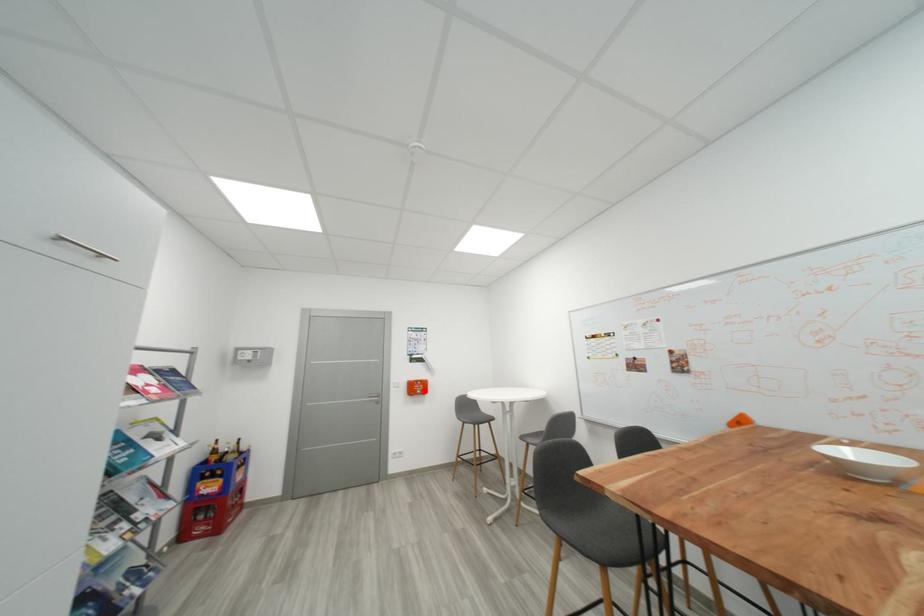
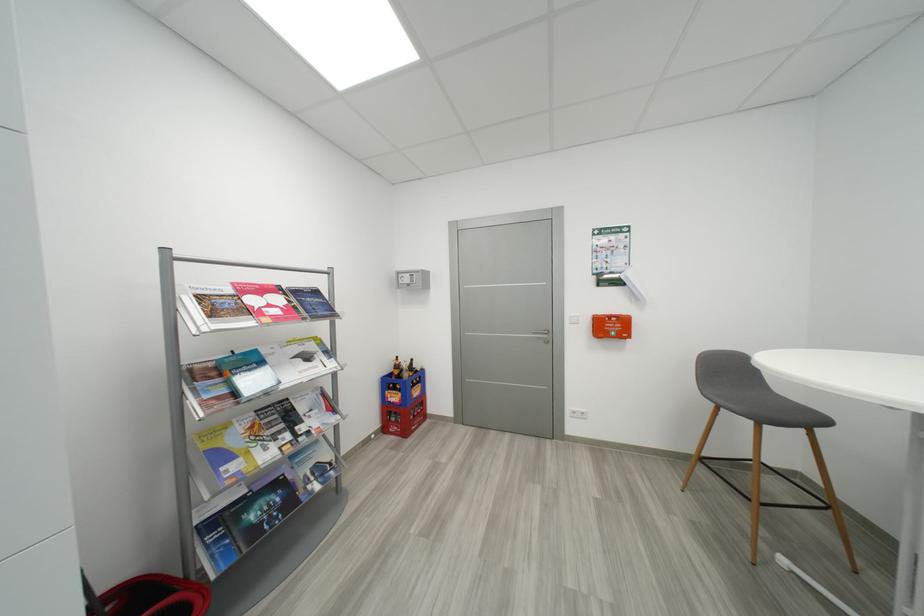
Find the pixel in the second image that matches the highlighted location in the first image.

(617, 330)